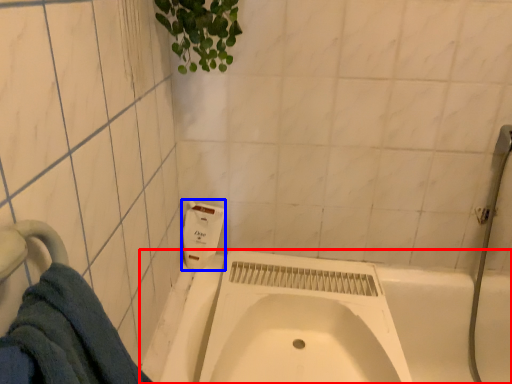
Question: Which of the following is the farthest to the observer, bath (highlighted by a red box) or soap dispenser (highlighted by a blue box)?

Choices:
 (A) bath
 (B) soap dispenser

Answer: (B)